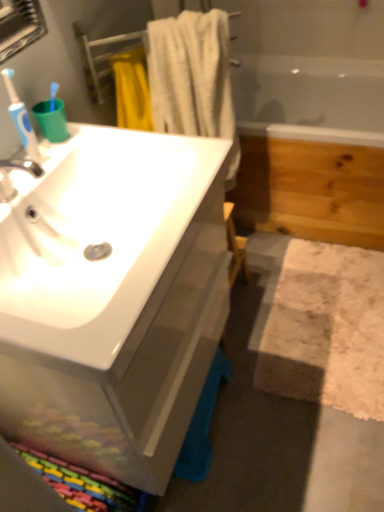
Describe the element at coordinates (20, 116) in the screenshot. I see `blue plastic toothbrush at left` at that location.

What is the approximate height of white cotton towel at upper center?

white cotton towel at upper center is 29.76 inches tall.

Locate an element on the screen. white textured bath mat at lower right is located at coordinates (327, 329).

Can you confirm if blue plastic toothbrush at left is thinner than white glossy sink at left?

Indeed, blue plastic toothbrush at left has a lesser width compared to white glossy sink at left.

Looking at this image, is blue plastic toothbrush at left to the right of white glossy sink at left from the viewer's perspective?

In fact, blue plastic toothbrush at left is to the left of white glossy sink at left.

From a real-world perspective, which object rests below the other?

white glossy sink at left.

How different are the orientations of blue plastic toothbrush at left and white glossy sink at left in degrees?

1.29 degrees.

I want to click on bath mat located on the right of white glossy sink at left, so click(x=327, y=329).

From a real-world perspective, who is located higher, white glossy sink at left or white textured bath mat at lower right?

white glossy sink at left.

From the image's perspective, which is below, white glossy sink at left or white textured bath mat at lower right?

white glossy sink at left appears lower in the image.

Is white glossy sink at left oriented away from white textured bath mat at lower right?

white glossy sink at left does not have its back to white textured bath mat at lower right.

Is white glossy sink at left at the back of white textured bath mat at lower right?

No, white glossy sink at left is not at the back of white textured bath mat at lower right.

Where is `bath mat on the right of white glossy sink at left`? This screenshot has width=384, height=512. bath mat on the right of white glossy sink at left is located at coordinates (327, 329).

Which object is positioned more to the left, white textured bath mat at lower right or white glossy sink at left?

white glossy sink at left.

In the scene shown: Is white textured bath mat at lower right facing away from wooden bathtub at right?

A: No.

Is white textured bath mat at lower right far away from wooden bathtub at right?

Indeed, white textured bath mat at lower right is not near wooden bathtub at right.

Is white textured bath mat at lower right located outside wooden bathtub at right?

Yes.

Based on the photo, between white textured bath mat at lower right and wooden bathtub at right, which one has smaller size?

Smaller between the two is white textured bath mat at lower right.

How much distance is there between white glossy sink at left and blue plastic toothbrush at left?

white glossy sink at left and blue plastic toothbrush at left are 17.89 inches apart.

From the image's perspective, is white glossy sink at left located above or below blue plastic toothbrush at left?

Based on their image positions, white glossy sink at left is located beneath blue plastic toothbrush at left.

In terms of height, does white glossy sink at left look taller or shorter compared to blue plastic toothbrush at left?

In the image, white glossy sink at left appears to be taller than blue plastic toothbrush at left.

Measure the distance between white cotton towel at upper center and white glossy sink at left.

61.63 centimeters.

Is white cotton towel at upper center with white glossy sink at left?

No, white cotton towel at upper center is not with white glossy sink at left.

Considering the relative positions of white cotton towel at upper center and white glossy sink at left in the image provided, is white cotton towel at upper center to the left or to the right of white glossy sink at left?

white cotton towel at upper center is to the right of white glossy sink at left.

Does point (219, 66) come closer to viewer compared to point (88, 429)?

No.

Is white cotton towel at upper center at the back of wooden bathtub at right?

No, wooden bathtub at right's orientation is not away from white cotton towel at upper center.

Find the location of a particular element. bath that appears above the white cotton towel at upper center (from the image's perspective) is located at coordinates (307, 116).

Between wooden bathtub at right and white cotton towel at upper center, which one appears on the right side from the viewer's perspective?

From the viewer's perspective, wooden bathtub at right appears more on the right side.

Measure the distance between wooden bathtub at right and white cotton towel at upper center.

wooden bathtub at right is 30.34 inches from white cotton towel at upper center.

Locate an element on the screen. This screenshot has height=512, width=384. toothbrush on the left of white glossy sink at left is located at coordinates (20, 116).

Identify the location of bathroom cabinet below the white textured bath mat at lower right (from the image's perspective). The width and height of the screenshot is (384, 512). pyautogui.click(x=113, y=298).

Which object lies further to the anchor point white glossy sink at left, white textured bath mat at lower right or wooden bathtub at right?

The object further to white glossy sink at left is wooden bathtub at right.

Which object lies nearer to the anchor point blue plastic toothbrush at left, white textured bath mat at lower right or white cotton towel at upper center?

white cotton towel at upper center is closer to blue plastic toothbrush at left.

Which object lies nearer to the anchor point white textured bath mat at lower right, white glossy sink at left or white cotton towel at upper center?

The object closer to white textured bath mat at lower right is white glossy sink at left.

When comparing their distances from white textured bath mat at lower right, does wooden bathtub at right or white cotton towel at upper center seem further?

Based on the image, wooden bathtub at right appears to be further to white textured bath mat at lower right.

Based on their spatial positions, is white glossy sink at left or wooden bathtub at right closer to white textured bath mat at lower right?

The object closer to white textured bath mat at lower right is white glossy sink at left.

Considering their positions, is white glossy sink at left positioned further to blue plastic toothbrush at left than wooden bathtub at right?

wooden bathtub at right.

Looking at the image, which one is located closer to white cotton towel at upper center, wooden bathtub at right or white textured bath mat at lower right?

wooden bathtub at right lies closer to white cotton towel at upper center than the other object.

Consider the image. Looking at the image, which one is located closer to white textured bath mat at lower right, wooden bathtub at right or white glossy sink at left?

white glossy sink at left is positioned closer to the anchor white textured bath mat at lower right.

This screenshot has width=384, height=512. I want to click on bath towel between wooden bathtub at right and white textured bath mat at lower right in the vertical direction, so click(x=193, y=78).

Image resolution: width=384 pixels, height=512 pixels. Find the location of `bath towel situated between blue plastic toothbrush at left and wooden bathtub at right from left to right`. bath towel situated between blue plastic toothbrush at left and wooden bathtub at right from left to right is located at coordinates (193, 78).

The height and width of the screenshot is (512, 384). Find the location of `bathroom cabinet between blue plastic toothbrush at left and wooden bathtub at right in the horizontal direction`. bathroom cabinet between blue plastic toothbrush at left and wooden bathtub at right in the horizontal direction is located at coordinates (113, 298).

Where is `bath situated between blue plastic toothbrush at left and white textured bath mat at lower right from left to right`? bath situated between blue plastic toothbrush at left and white textured bath mat at lower right from left to right is located at coordinates (307, 116).